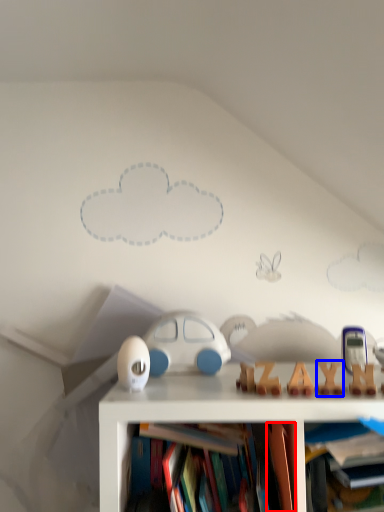
Question: Which point is closer to the camera, book (highlighted by a red box) or toy (highlighted by a blue box)?

Choices:
 (A) book
 (B) toy

Answer: (A)